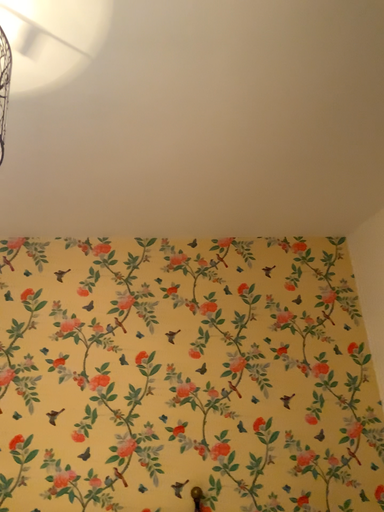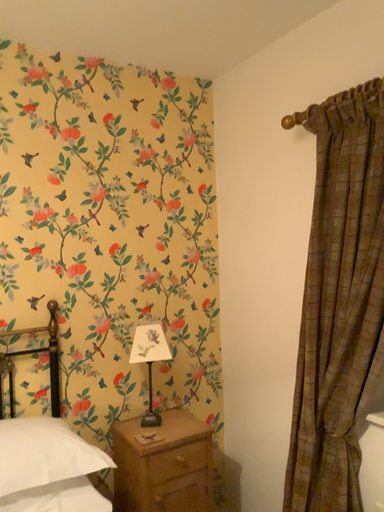
Question: How did the camera likely rotate when shooting the video?

Choices:
 (A) rotated right
 (B) rotated left

Answer: (A)